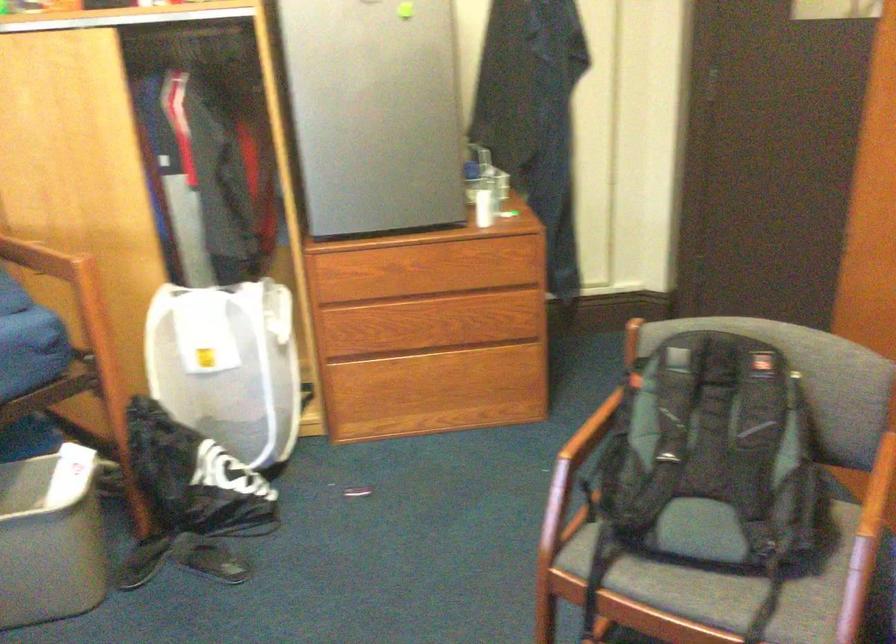
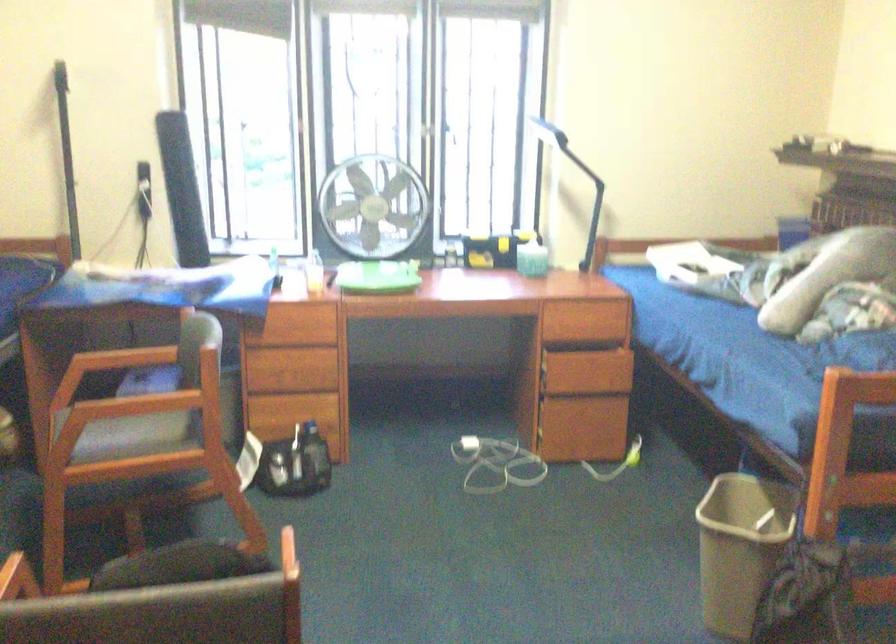
Question: I am providing you with two images of the same scene from different viewpoints. Please identify which objects are invisible in image2.

Choices:
 (A) wooden desk drawer
 (B) blue rolled mat
 (C) wooden chair armrest
 (D) brass door lock

Answer: (C)